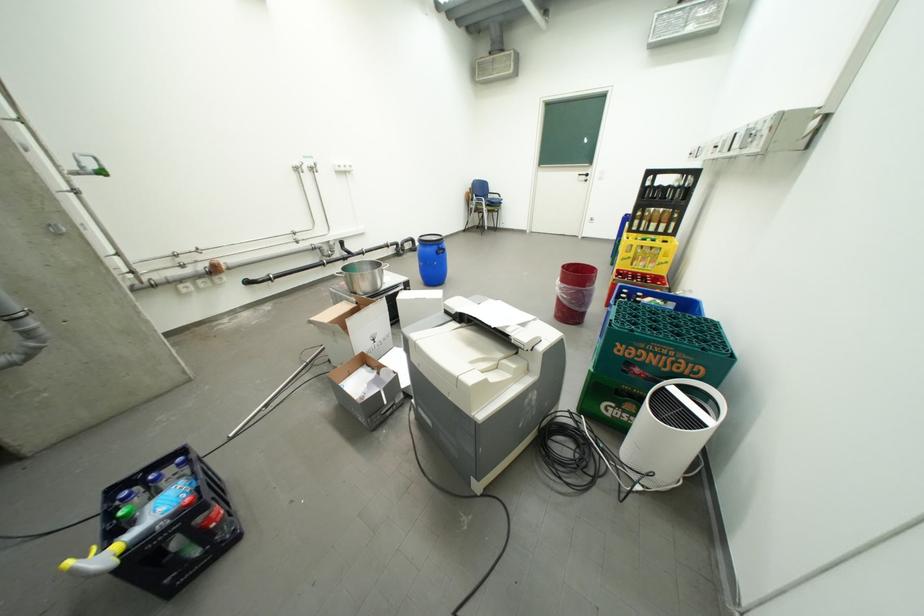
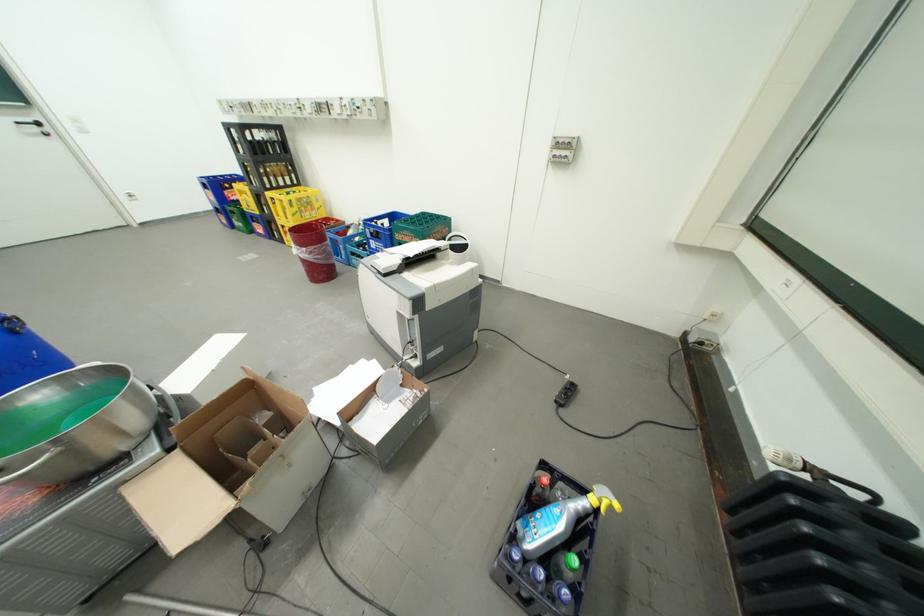
Find the pixel in the second image that matches [570,284] in the first image.

(314, 249)